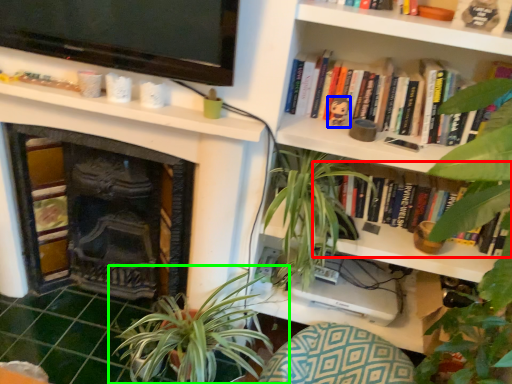
Question: Considering the real-world distances, which object is closest to book (highlighted by a red box)? toy (highlighted by a blue box) or houseplant (highlighted by a green box).

Choices:
 (A) toy
 (B) houseplant

Answer: (A)